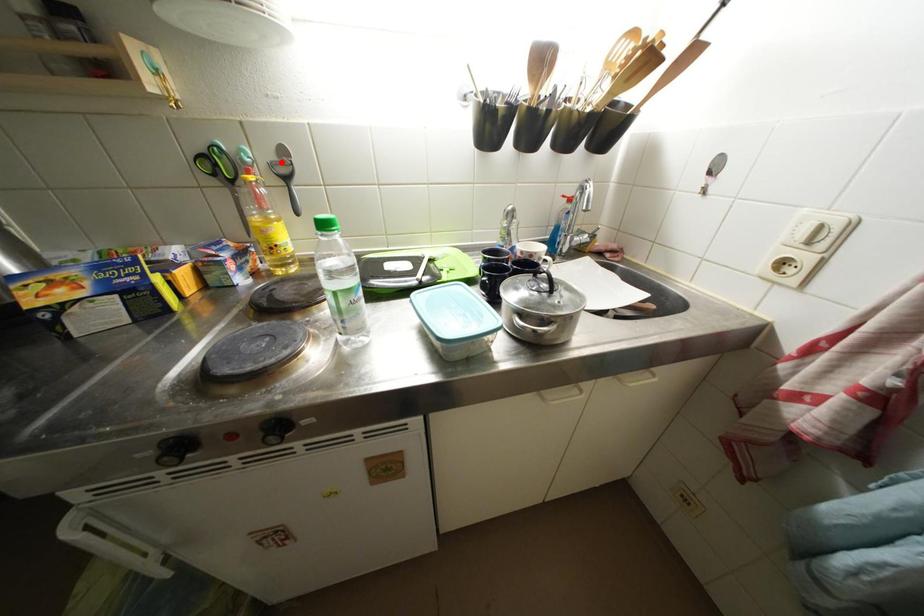
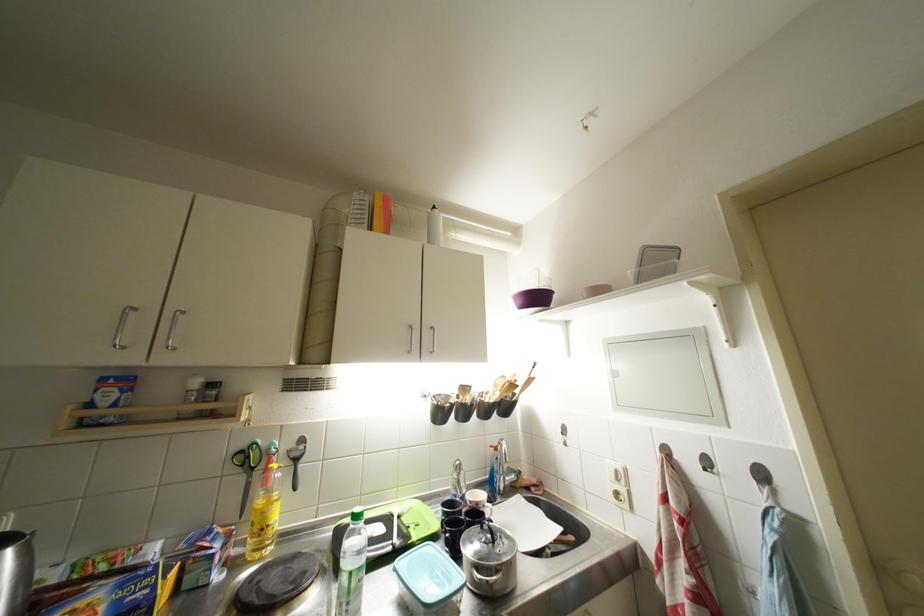
Question: I am providing you with two images of the same scene from different viewpoints. A red point is marked on the first image. Is the red point's position out of view in image 2?

Choices:
 (A) Yes
 (B) No

Answer: (B)